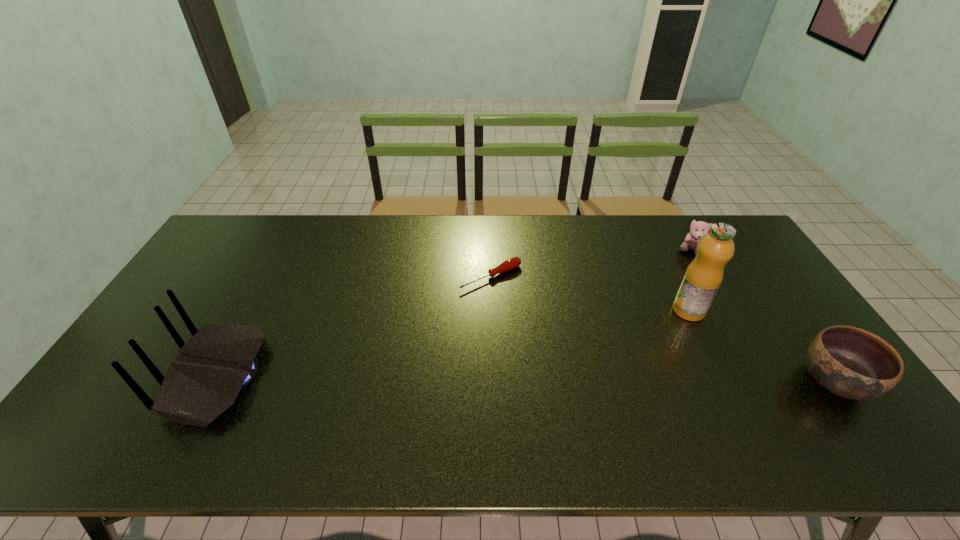
Locate an element on the screen. The height and width of the screenshot is (540, 960). free point located on the back of the fourth shortest object is located at coordinates (132, 377).

Where is `vacant space located on the back of the rightmost object`? The height and width of the screenshot is (540, 960). vacant space located on the back of the rightmost object is located at coordinates (800, 332).

Find the location of a particular element. vacant space positioned 0.130m at the tip of the shortest object is located at coordinates (536, 314).

Identify the location of vacant space located 0.290m at the tip of the shortest object. Image resolution: width=960 pixels, height=540 pixels. (573, 349).

At what (x,y) coordinates should I click in order to perform the action: click on free region located 0.200m at the tip of the shortest object. Please return your answer as a coordinate pair (x, y). Looking at the image, I should click on 551,329.

Image resolution: width=960 pixels, height=540 pixels. Find the location of `free space located on the front label of the fruit juice`. free space located on the front label of the fruit juice is located at coordinates (626, 353).

At what (x,y) coordinates should I click in order to perform the action: click on free space located 0.090m on the front label of the fruit juice. Please return your answer as a coordinate pair (x, y). This screenshot has width=960, height=540. Looking at the image, I should click on (659, 330).

Where is `vacant position located 0.170m on the front label of the fruit juice`? The image size is (960, 540). vacant position located 0.170m on the front label of the fruit juice is located at coordinates (640, 343).

The height and width of the screenshot is (540, 960). What are the coordinates of `blank space located 0.200m at the face of the farthest object` in the screenshot? It's located at (657, 284).

Where is `blank space located 0.370m at the face of the farthest object`? The height and width of the screenshot is (540, 960). blank space located 0.370m at the face of the farthest object is located at coordinates (629, 312).